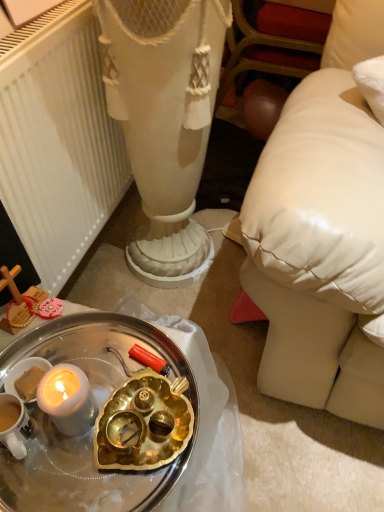
Question: Does white metallic tray at lower left have a smaller size compared to white matte radiator at left?

Choices:
 (A) yes
 (B) no

Answer: (A)

Question: Is white metallic tray at lower left at the left side of white matte radiator at left?

Choices:
 (A) yes
 (B) no

Answer: (B)

Question: Considering the relative sizes of white metallic tray at lower left and white matte radiator at left in the image provided, is white metallic tray at lower left wider than white matte radiator at left?

Choices:
 (A) no
 (B) yes

Answer: (B)

Question: From a real-world perspective, is white metallic tray at lower left positioned under white matte radiator at left based on gravity?

Choices:
 (A) yes
 (B) no

Answer: (B)

Question: Would you say white metallic tray at lower left is outside white matte radiator at left?

Choices:
 (A) no
 (B) yes

Answer: (B)

Question: Does white metallic tray at lower left turn towards white matte radiator at left?

Choices:
 (A) yes
 (B) no

Answer: (B)

Question: Is white matte radiator at left looking in the opposite direction of white metallic tray at lower left?

Choices:
 (A) yes
 (B) no

Answer: (B)

Question: Can you confirm if white matte radiator at left is positioned to the left of white metallic tray at lower left?

Choices:
 (A) no
 (B) yes

Answer: (B)

Question: Is white matte radiator at left aimed at white metallic tray at lower left?

Choices:
 (A) no
 (B) yes

Answer: (A)

Question: From the image's perspective, is white matte radiator at left located above white metallic tray at lower left?

Choices:
 (A) no
 (B) yes

Answer: (B)

Question: Is white matte radiator at left smaller than white metallic tray at lower left?

Choices:
 (A) yes
 (B) no

Answer: (B)

Question: Considering the relative positions of white matte radiator at left and white metallic tray at lower left in the image provided, is white matte radiator at left in front of white metallic tray at lower left?

Choices:
 (A) yes
 (B) no

Answer: (B)

Question: Does point (71, 252) appear closer or farther from the camera than point (109, 382)?

Choices:
 (A) farther
 (B) closer

Answer: (A)